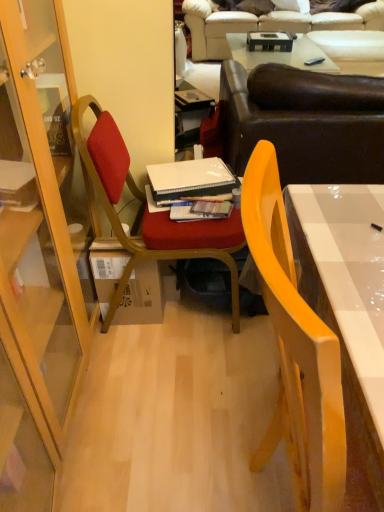
What is the approximate height of matte cardboard box at center?

14.30 inches.

You are a GUI agent. You are given a task and a screenshot of the screen. Output one action in this format:
    pyautogui.click(x=<x>, y=<y>)
    Task: Click on the hardcover book at center, positioned as the first book in front-to-back order
    This screenshot has width=384, height=512.
    Given the screenshot: What is the action you would take?
    pyautogui.click(x=200, y=210)

The height and width of the screenshot is (512, 384). In order to click on yellow glossy chair at right, the second chair from the back in this screenshot , I will do `click(295, 349)`.

Considering the positions of objects velvet red chair at center, acting as the first chair starting from the back, and beige leather couch at upper center, marked as the second studio couch in a bottom-to-top arrangement, in the image provided, who is more to the right, velvet red chair at center, acting as the first chair starting from the back, or beige leather couch at upper center, marked as the second studio couch in a bottom-to-top arrangement,?

From the viewer's perspective, beige leather couch at upper center, marked as the second studio couch in a bottom-to-top arrangement, appears more on the right side.

From the image's perspective, is velvet red chair at center, the 2th chair in the front-to-back sequence, located beneath beige leather couch at upper center, which ranks as the first studio couch in top-to-bottom order?

Yes, from the image's perspective, velvet red chair at center, the 2th chair in the front-to-back sequence, is below beige leather couch at upper center, which ranks as the first studio couch in top-to-bottom order.

Based on the photo, between velvet red chair at center, acting as the first chair starting from the back, and beige leather couch at upper center, marked as the second studio couch in a bottom-to-top arrangement, which one has larger size?

With larger size is beige leather couch at upper center, marked as the second studio couch in a bottom-to-top arrangement.

Can you confirm if velvet red chair at center, the 2th chair in the front-to-back sequence, is taller than beige leather couch at upper center, the first studio couch positioned from the back?

Yes, velvet red chair at center, the 2th chair in the front-to-back sequence, is taller than beige leather couch at upper center, the first studio couch positioned from the back.

From the image's perspective, would you say velvet red chair at center, acting as the first chair starting from the back, is shown under brown leather couch at upper center, marked as the first studio couch in a front-to-back arrangement?

Yes.

Considering the positions of point (236, 284) and point (221, 78), is point (236, 284) closer or farther from the camera than point (221, 78)?

Point (236, 284) appears to be closer to the viewer than point (221, 78).

From a real-world perspective, relative to brown leather couch at upper center, which ranks as the first studio couch in bottom-to-top order, is velvet red chair at center, acting as the first chair starting from the back, vertically above or below?

In terms of real-world spatial position, velvet red chair at center, acting as the first chair starting from the back, is below brown leather couch at upper center, which ranks as the first studio couch in bottom-to-top order.

Based on the photo, does brown leather couch at upper center, which ranks as the first studio couch in bottom-to-top order, have a larger size compared to hardcover book at center, which is the 2th book from back to front?

Yes.

Based on the photo, between brown leather couch at upper center, marked as the first studio couch in a front-to-back arrangement, and hardcover book at center, positioned as the first book in front-to-back order, which one appears on the right side from the viewer's perspective?

brown leather couch at upper center, marked as the first studio couch in a front-to-back arrangement, is more to the right.

Looking at their sizes, would you say brown leather couch at upper center, which ranks as the first studio couch in bottom-to-top order, is wider or thinner than hardcover book at center, positioned as the first book in front-to-back order?

In the image, brown leather couch at upper center, which ranks as the first studio couch in bottom-to-top order, appears to be wider than hardcover book at center, positioned as the first book in front-to-back order.

Does brown leather couch at upper center, marked as the first studio couch in a front-to-back arrangement, turn towards hardcover book at center, positioned as the first book in front-to-back order?

No, brown leather couch at upper center, marked as the first studio couch in a front-to-back arrangement, is not oriented towards hardcover book at center, positioned as the first book in front-to-back order.

Is point (254, 174) behind point (342, 95)?

No, (254, 174) is in front of (342, 95).

What's the angular difference between yellow glossy chair at right, marked as the 1th chair in a front-to-back arrangement, and brown leather couch at upper center, which is the second studio couch in back-to-front order,'s facing directions?

The facing directions of yellow glossy chair at right, marked as the 1th chair in a front-to-back arrangement, and brown leather couch at upper center, which is the second studio couch in back-to-front order, are 89.2 degrees apart.

Between yellow glossy chair at right, marked as the 1th chair in a front-to-back arrangement, and brown leather couch at upper center, which is the second studio couch in back-to-front order, which one has larger width?

With larger width is brown leather couch at upper center, which is the second studio couch in back-to-front order.

Based on the photo, is matte cardboard box at center shorter than brown leather couch at upper center, which ranks as the first studio couch in bottom-to-top order?

Correct, matte cardboard box at center is not as tall as brown leather couch at upper center, which ranks as the first studio couch in bottom-to-top order.

Measure the distance between matte cardboard box at center and brown leather couch at upper center, marked as the first studio couch in a front-to-back arrangement.

matte cardboard box at center and brown leather couch at upper center, marked as the first studio couch in a front-to-back arrangement, are 31.79 inches apart.

Looking at their sizes, would you say matte cardboard box at center is wider or thinner than brown leather couch at upper center, marked as the first studio couch in a front-to-back arrangement?

Clearly, matte cardboard box at center has less width compared to brown leather couch at upper center, marked as the first studio couch in a front-to-back arrangement.

Locate an element on the screen. This screenshot has width=384, height=512. box below the yellow glossy chair at right, the second chair from the back (from a real-world perspective) is located at coordinates (141, 297).

Which object is positioned more to the right, matte cardboard box at center or yellow glossy chair at right, the second chair from the back?

yellow glossy chair at right, the second chair from the back, is more to the right.

Is matte cardboard box at center in front of or behind yellow glossy chair at right, marked as the 1th chair in a front-to-back arrangement, in the image?

matte cardboard box at center is behind yellow glossy chair at right, marked as the 1th chair in a front-to-back arrangement.

From the image's perspective, is matte cardboard box at center over yellow glossy chair at right, marked as the 1th chair in a front-to-back arrangement?

Correct, matte cardboard box at center appears higher than yellow glossy chair at right, marked as the 1th chair in a front-to-back arrangement, in the image.

Is beige leather couch at upper center, the first studio couch positioned from the back, situated inside hardcover book at center, which is the 2th book from back to front, or outside?

beige leather couch at upper center, the first studio couch positioned from the back, is located beyond the bounds of hardcover book at center, which is the 2th book from back to front.

Which is more to the left, beige leather couch at upper center, which ranks as the first studio couch in top-to-bottom order, or hardcover book at center, positioned as the first book in front-to-back order?

Positioned to the left is hardcover book at center, positioned as the first book in front-to-back order.

How many degrees apart are the facing directions of beige leather couch at upper center, which ranks as the first studio couch in top-to-bottom order, and hardcover book at center, positioned as the first book in front-to-back order?

The facing directions of beige leather couch at upper center, which ranks as the first studio couch in top-to-bottom order, and hardcover book at center, positioned as the first book in front-to-back order, are 4.51 degrees apart.

The image size is (384, 512). Find the location of `the 1st book counting from the left of the beige leather couch at upper center, marked as the second studio couch in a bottom-to-top arrangement`. the 1st book counting from the left of the beige leather couch at upper center, marked as the second studio couch in a bottom-to-top arrangement is located at coordinates (200, 210).

From a real-world perspective, which chair is the 1st one above the beige leather couch at upper center, the first studio couch positioned from the back? Please provide its 2D coordinates.

[(148, 211)]

Locate an element on the screen. studio couch that is the 1st one when counting rightward from the velvet red chair at center, acting as the first chair starting from the back is located at coordinates (304, 122).

From the image, which object appears to be nearer to brown leather couch at upper center, marked as the first studio couch in a front-to-back arrangement, hardcover book at center, positioned as the first book in front-to-back order, or velvet red chair at center, the 2th chair in the front-to-back sequence?

velvet red chair at center, the 2th chair in the front-to-back sequence.

From the picture: Based on their spatial positions, is hardcover book at center, positioned as the first book in front-to-back order, or yellow glossy chair at right, marked as the 1th chair in a front-to-back arrangement, closer to matte cardboard box at center?

Based on the image, hardcover book at center, positioned as the first book in front-to-back order, appears to be nearer to matte cardboard box at center.

Looking at the image, which one is located closer to yellow glossy chair at right, the second chair from the back, white matte notebook at center, the 1th book from the back, or hardcover book at center, which is the 2th book from back to front?

The object closer to yellow glossy chair at right, the second chair from the back, is hardcover book at center, which is the 2th book from back to front.

Considering their positions, is brown leather couch at upper center, which is counted as the second studio couch, starting from the top, positioned further to white matte notebook at center, the second book from the front, than beige leather couch at upper center, which ranks as the first studio couch in top-to-bottom order?

beige leather couch at upper center, which ranks as the first studio couch in top-to-bottom order, is further to white matte notebook at center, the second book from the front.

Based on their spatial positions, is white matte notebook at center, the 1th book from the back, or beige leather couch at upper center, marked as the second studio couch in a bottom-to-top arrangement, closer to hardcover book at center, positioned as the first book in front-to-back order?

white matte notebook at center, the 1th book from the back, is positioned closer to the anchor hardcover book at center, positioned as the first book in front-to-back order.

Based on their spatial positions, is brown leather couch at upper center, which is counted as the second studio couch, starting from the top, or hardcover book at center, which is the 2th book from back to front, further from white matte notebook at center, the 1th book from the back?

Based on the image, brown leather couch at upper center, which is counted as the second studio couch, starting from the top, appears to be further to white matte notebook at center, the 1th book from the back.

In the scene shown: Which object lies nearer to the anchor point hardcover book at center, which is the 2th book from back to front, beige leather couch at upper center, which appears as the second studio couch when viewed from the front, or velvet red chair at center, acting as the first chair starting from the back?

velvet red chair at center, acting as the first chair starting from the back, is closer to hardcover book at center, which is the 2th book from back to front.

Looking at the image, which one is located closer to velvet red chair at center, the 2th chair in the front-to-back sequence, hardcover book at center, positioned as the first book in front-to-back order, or brown leather couch at upper center, which is counted as the second studio couch, starting from the top?

Based on the image, hardcover book at center, positioned as the first book in front-to-back order, appears to be nearer to velvet red chair at center, the 2th chair in the front-to-back sequence.

Identify the location of book located between brown leather couch at upper center, which is the second studio couch in back-to-front order, and beige leather couch at upper center, which ranks as the first studio couch in top-to-bottom order, in the depth direction. The image size is (384, 512). (188, 182).

Locate an element on the screen. The width and height of the screenshot is (384, 512). book between yellow glossy chair at right, the second chair from the back, and white matte notebook at center, the 1th book from the back, in the front-back direction is located at coordinates (200, 210).

Identify the location of box between yellow glossy chair at right, marked as the 1th chair in a front-to-back arrangement, and beige leather couch at upper center, the first studio couch positioned from the back, in the front-back direction. (141, 297).

Find the location of a particular element. The image size is (384, 512). book that lies between white matte notebook at center, the 1th book from the back, and matte cardboard box at center from top to bottom is located at coordinates (200, 210).